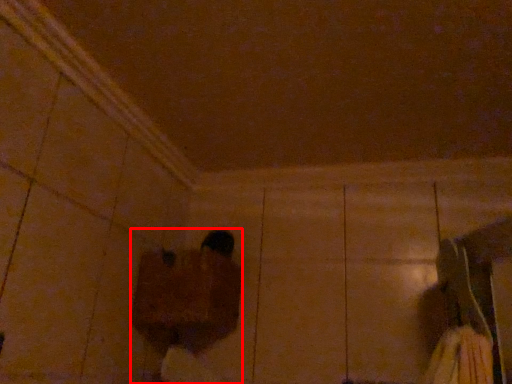
Question: From the image's perspective, where is person (annotated by the red box) located in relation to footwear in the image?

Choices:
 (A) above
 (B) below

Answer: (B)